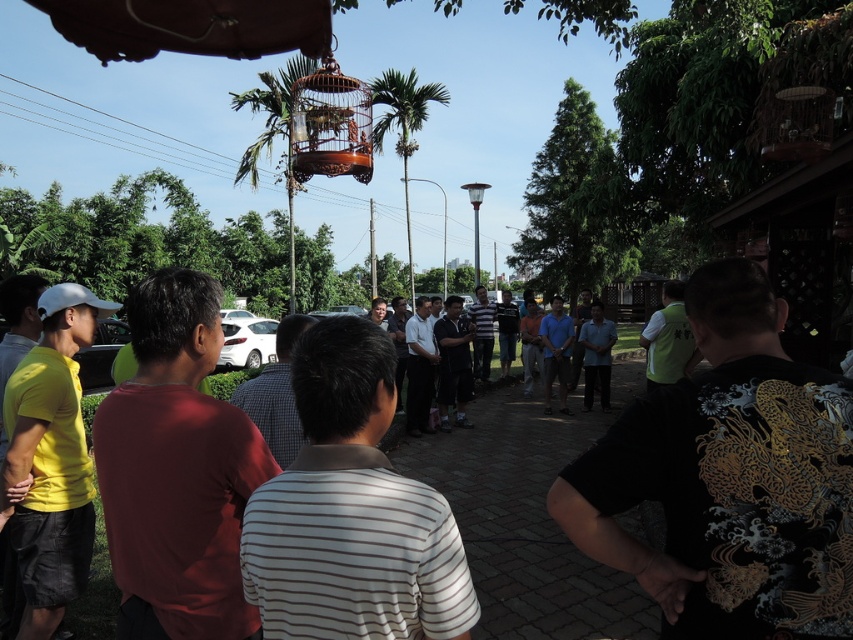
Question: Can you confirm if wooden birdcage at center is positioned to the left of green leafy palm tree at upper center?

Choices:
 (A) no
 (B) yes

Answer: (A)

Question: From the image, what is the correct spatial relationship of wooden birdcage at center in relation to white glossy car at center?

Choices:
 (A) right
 (B) left

Answer: (A)

Question: Where is wooden birdcage at center located in relation to white glossy car at center in the image?

Choices:
 (A) left
 (B) right

Answer: (B)

Question: Which object appears closest to the camera in this image?

Choices:
 (A) white glossy car at center
 (B) green leafy palm tree at center

Answer: (A)

Question: Considering the real-world distances, which object is farthest from the wooden birdcage at center?

Choices:
 (A) white glossy car at center
 (B) green leafy palm tree at center
 (C) green leafy palm tree at upper center

Answer: (B)

Question: Which object is the closest to the green leafy palm tree at center?

Choices:
 (A) green leafy palm tree at upper center
 (B) wooden birdcage at center
 (C) white glossy car at center

Answer: (A)